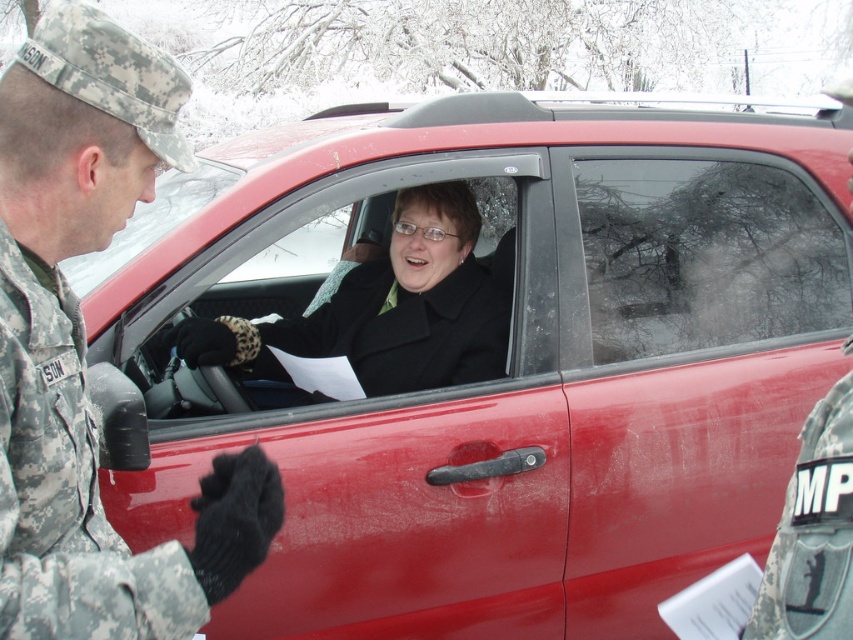
What is the spatial relationship between the camouflage fabric uniform at left and the red car in the scene?

The camouflage fabric uniform at left is positioned to the left of the red car in the scene.

You are a photographer trying to capture a clear shot of both the camouflage fabric uniform at left and the black wool coat at center. Since you can only focus on one subject at a time, which one should you focus on to ensure the other is also in focus?

The camouflage fabric uniform at left is positioned on the left side of black wool coat at center. Therefore, focusing on the black wool coat at center will keep the camouflage fabric uniform at left in focus as well.